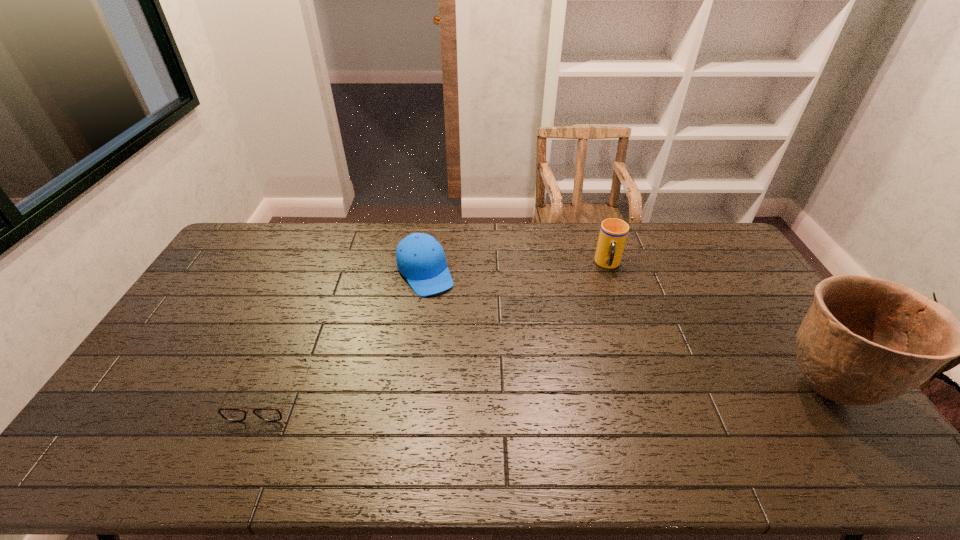
Where is `free space between the leftmost object and the pottery`? Image resolution: width=960 pixels, height=540 pixels. free space between the leftmost object and the pottery is located at coordinates (546, 390).

I want to click on free space that is in between the shortest object and the second object from left to right, so click(x=347, y=332).

The height and width of the screenshot is (540, 960). Identify the location of vacant area between the sunglasses and the cap. (347, 332).

The height and width of the screenshot is (540, 960). Find the location of `unoccupied position between the shortest object and the cup`. unoccupied position between the shortest object and the cup is located at coordinates (438, 328).

At what (x,y) coordinates should I click in order to perform the action: click on free spot between the shortest object and the pottery. Please return your answer as a coordinate pair (x, y). This screenshot has width=960, height=540. Looking at the image, I should click on (546, 390).

The image size is (960, 540). Find the location of `vacant space that is in between the cup and the third object from right to left`. vacant space that is in between the cup and the third object from right to left is located at coordinates (516, 269).

Locate which object is the third closest to the third tallest object. Please provide its 2D coordinates. Your answer should be formatted as a tuple, i.e. [(x, y)], where the tuple contains the x and y coordinates of a point satisfying the conditions above.

[(864, 341)]

Select which object is the closest to the cup. Please provide its 2D coordinates. Your answer should be formatted as a tuple, i.e. [(x, y)], where the tuple contains the x and y coordinates of a point satisfying the conditions above.

[(864, 341)]

Locate an element on the screen. Image resolution: width=960 pixels, height=540 pixels. vacant position in the image that satisfies the following two spatial constraints: 1. on the front side of the second object from right to left; 2. on the right side of the pottery is located at coordinates (651, 389).